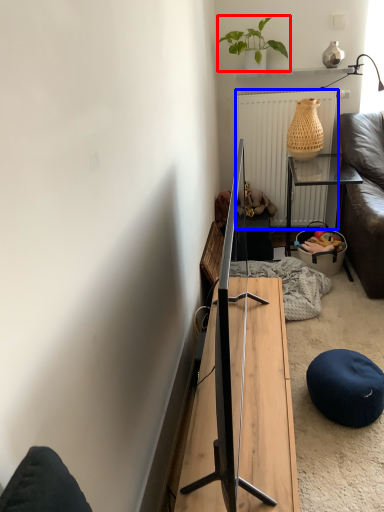
Question: Which object appears closest to the camera in this image, houseplant (highlighted by a red box) or radiator (highlighted by a blue box)?

Choices:
 (A) houseplant
 (B) radiator

Answer: (A)